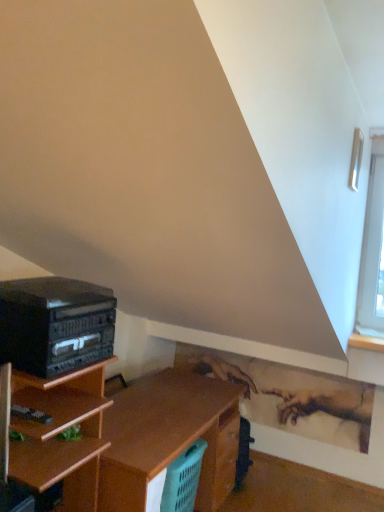
Question: Considering the positions of point (87, 297) and point (354, 175), is point (87, 297) closer or farther from the camera than point (354, 175)?

Choices:
 (A) farther
 (B) closer

Answer: (B)

Question: Is black matte stereo at left to the left or to the right of clear glass window at upper right in the image?

Choices:
 (A) left
 (B) right

Answer: (A)

Question: Which object is positioned farthest from the teal plastic laundry basket at lower center?

Choices:
 (A) black matte stereo at left
 (B) clear glass window at upper right

Answer: (B)

Question: Based on their relative distances, which object is farther from the clear glass window at upper right?

Choices:
 (A) teal plastic laundry basket at lower center
 (B) black matte stereo at left

Answer: (A)